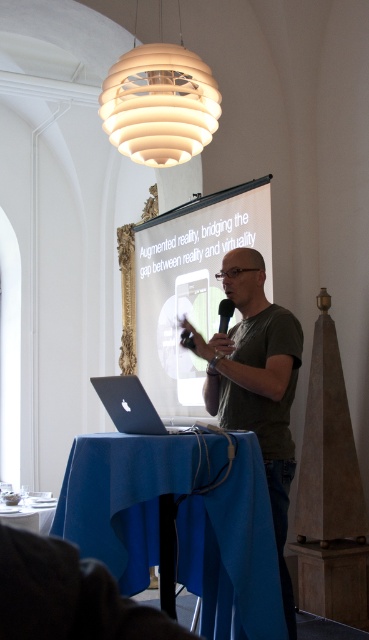
Question: Among these points, which one is farthest from the camera?

Choices:
 (A) (132, 419)
 (B) (150, 83)

Answer: (B)

Question: Which of these objects is positioned farthest from the white matte spherical lamp at upper center?

Choices:
 (A) silver metallic laptop at lower left
 (B) blue fabric table at lower left

Answer: (B)

Question: Which is farther from the silver metallic laptop at lower left?

Choices:
 (A) white glossy projector screen at center
 (B) matte green shirt at center
 (C) blue fabric tablecloth at lower center
 (D) black plastic microphone at center

Answer: (A)

Question: In this image, where is white glossy projector screen at center located relative to matte green shirt at center?

Choices:
 (A) left
 (B) right

Answer: (A)

Question: Considering the relative positions of blue fabric tablecloth at lower center and white matte spherical lamp at upper center in the image provided, where is blue fabric tablecloth at lower center located with respect to white matte spherical lamp at upper center?

Choices:
 (A) right
 (B) left

Answer: (A)

Question: Is blue fabric tablecloth at lower center smaller than silver metallic laptop at lower left?

Choices:
 (A) yes
 (B) no

Answer: (B)